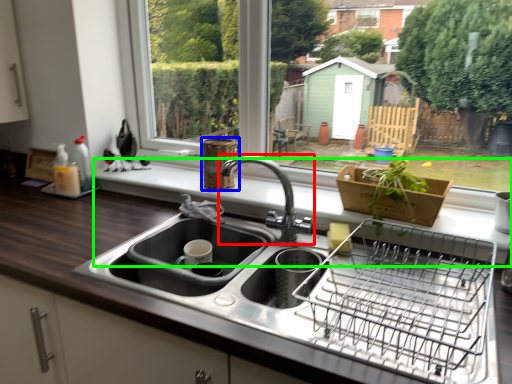
Question: Which object is the farthest from tap (highlighted by a red box)? Choose among these: basket (highlighted by a blue box) or window sill (highlighted by a green box).

Choices:
 (A) basket
 (B) window sill

Answer: (B)